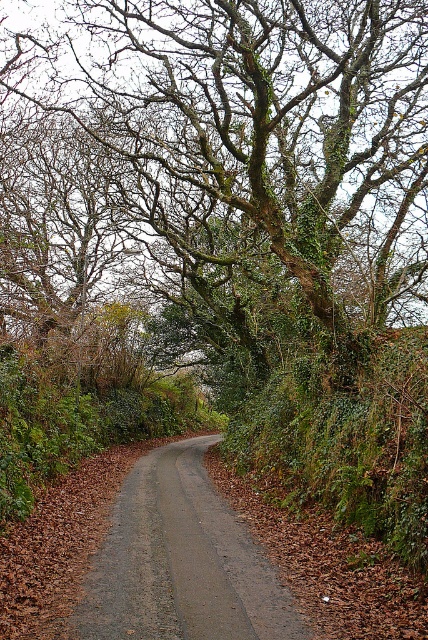
Which is more to the right, green mossy tree at upper center or gray gravel road at center?

From the viewer's perspective, gray gravel road at center appears more on the right side.

Is green mossy tree at upper center thinner than gray gravel road at center?

Incorrect, green mossy tree at upper center's width is not less than gray gravel road at center's.

Which is in front, point (39, 77) or point (190, 548)?

Point (190, 548) is in front.

This screenshot has height=640, width=428. Find the location of `green mossy tree at upper center`. green mossy tree at upper center is located at coordinates (253, 157).